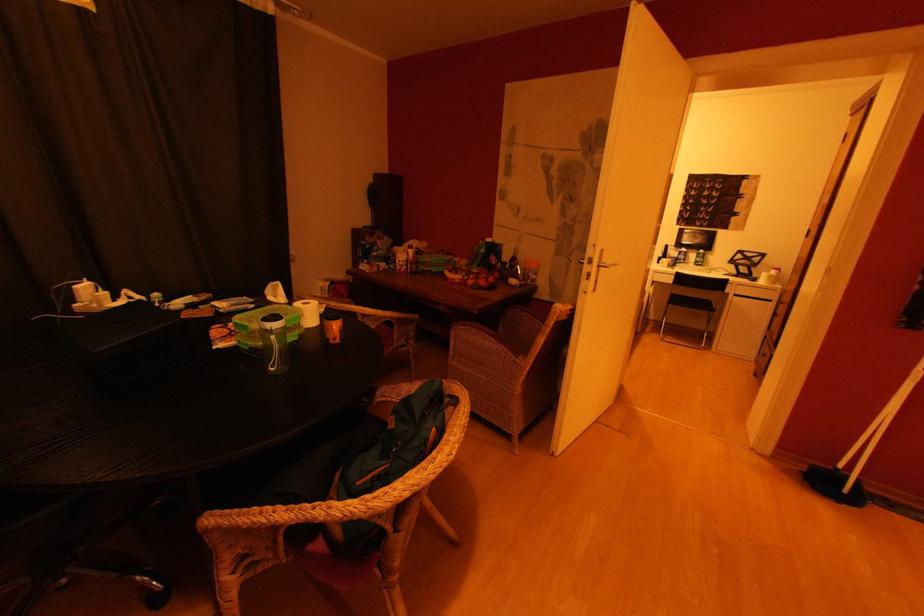
What do you see at coordinates (274, 342) in the screenshot? I see `a water bottle with strap` at bounding box center [274, 342].